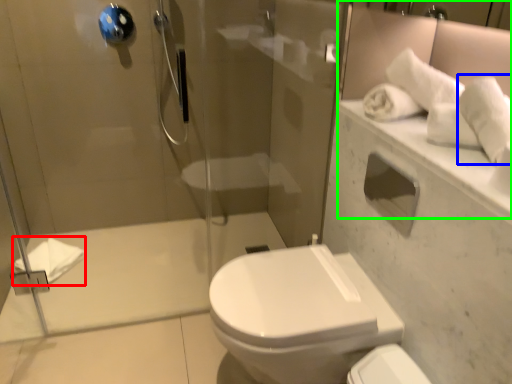
Question: Which object is the farthest from bath towel (highlighted by a red box)? Choose among these: bath towel (highlighted by a blue box) or mirror (highlighted by a green box).

Choices:
 (A) bath towel
 (B) mirror

Answer: (A)